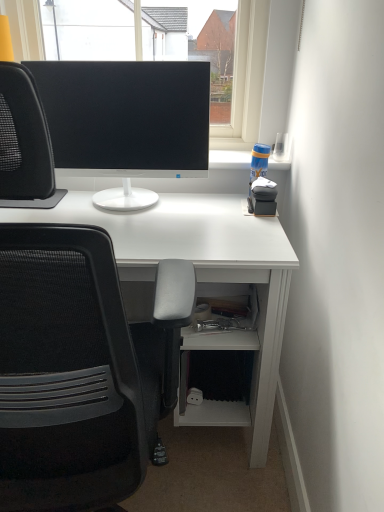
Question: From their relative heights in the image, would you say matte black monitor at center is taller or shorter than black mesh chair at left?

Choices:
 (A) short
 (B) tall

Answer: (A)

Question: Based on their positions, is matte black monitor at center located to the left or right of black mesh chair at left?

Choices:
 (A) right
 (B) left

Answer: (A)

Question: Which is nearer to the black mesh chair at left?

Choices:
 (A) matte black monitor at center
 (B) black matte monitor at upper center

Answer: (A)

Question: Which object is positioned farthest from the black mesh chair at left?

Choices:
 (A) black matte monitor at upper center
 (B) matte black monitor at center

Answer: (A)